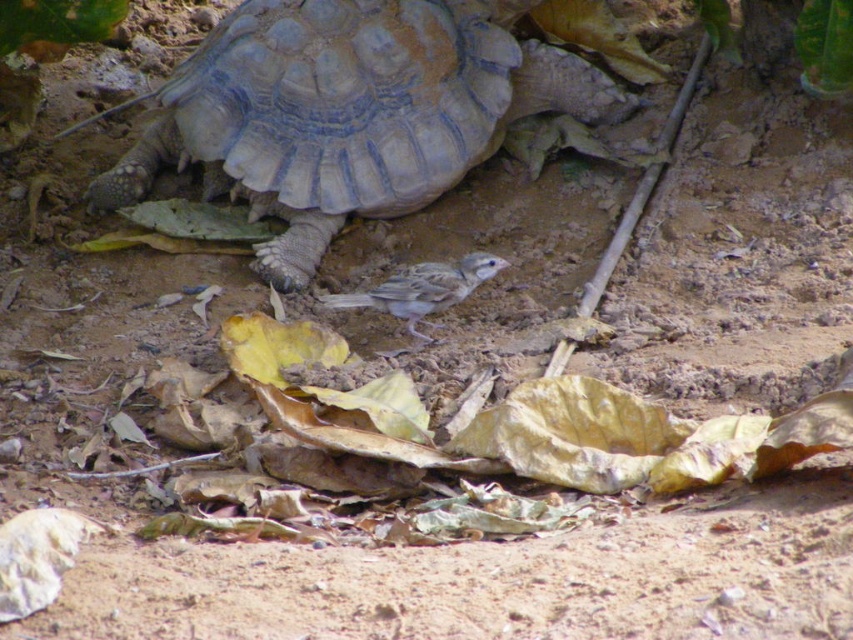
You are standing in the outdoor scene and want to pick up an object closer to you. Which point should you choose between point (164, 150) and point (421, 291)?

Point (164, 150) is further to the viewer than point (421, 291), so you should choose point (164, 150) as it is closer to you.

You are a photographer trying to capture both the gray textured shell at center and the gray matte bird at center in a single frame. Which object should you adjust your camera focus on first if you want to ensure both are in focus, considering their sizes?

The gray textured shell at center is wider than the gray matte bird at center, so you should focus on the gray textured shell at center first to ensure both are in focus.